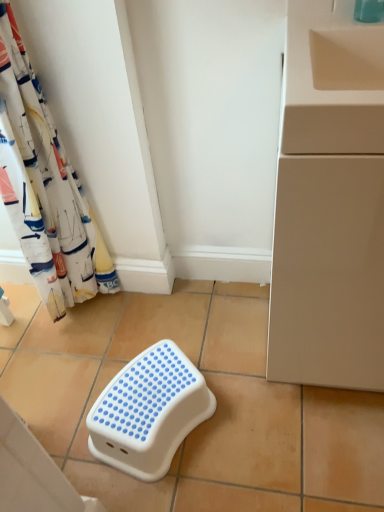
Locate an element on the screen. This screenshot has height=512, width=384. vacant area that lies in front of white plastic step stool at center is located at coordinates (185, 486).